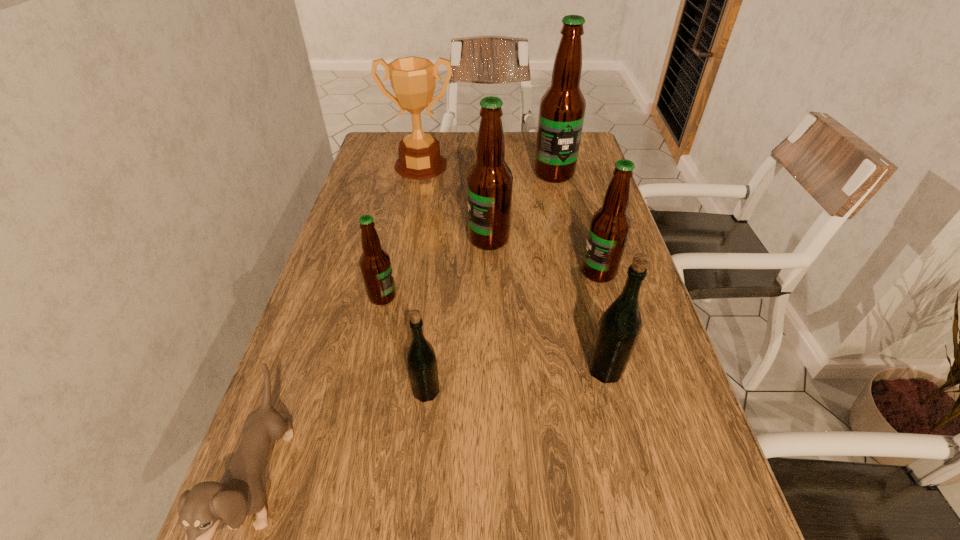
You are a GUI agent. You are given a task and a screenshot of the screen. Output one action in this format:
    pyautogui.click(x=<x>, y=<y>)
    Task: Click on the free space that satisfies the following two spatial constraints: 1. on the label of the tallest beer bottle; 2. on the label of the third brown beer bottle from right to left
    
    Given the screenshot: What is the action you would take?
    pyautogui.click(x=569, y=239)

The height and width of the screenshot is (540, 960). Identify the location of free space that satisfies the following two spatial constraints: 1. on the label of the farthest brown beer bottle; 2. on the right side of the bigger green beer bottle. (599, 370).